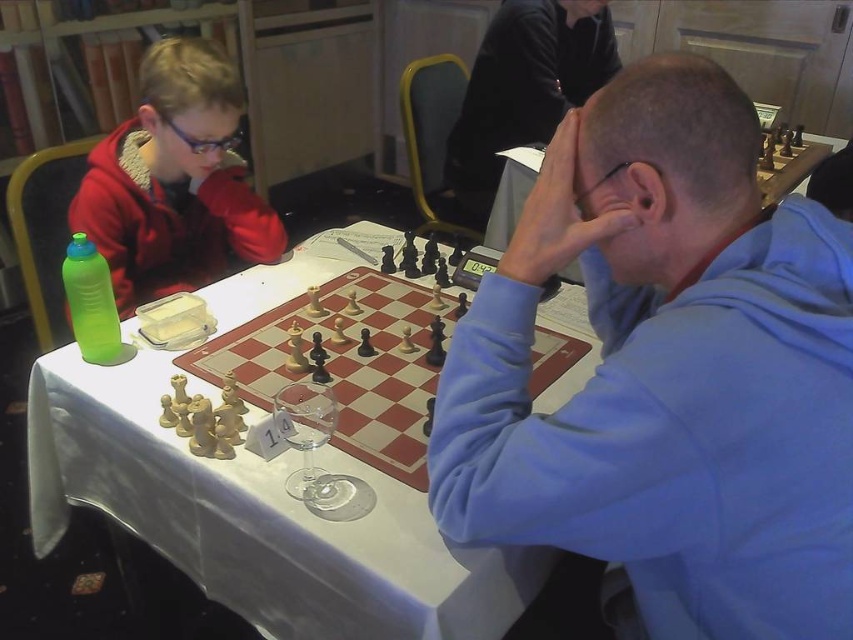
Question: Does matte red jacket at upper left appear on the right side of wooden chessboard at center?

Choices:
 (A) yes
 (B) no

Answer: (B)

Question: Can you confirm if wooden chess set at center is wider than smooth black jacket at upper center?

Choices:
 (A) no
 (B) yes

Answer: (B)

Question: Is blue fleece jacket at center further to the viewer compared to matte red jacket at upper left?

Choices:
 (A) no
 (B) yes

Answer: (A)

Question: Which point is farther from the camera taking this photo?

Choices:
 (A) (583, 346)
 (B) (155, 228)
 (C) (328, 460)
 (D) (790, 579)

Answer: (B)

Question: Which of these objects is positioned closest to the wooden chessboard at center?

Choices:
 (A) matte red jacket at upper left
 (B) wooden chess set at center

Answer: (B)

Question: Among these objects, which one is nearest to the camera?

Choices:
 (A) matte red jacket at upper left
 (B) wooden chess set at center
 (C) blue fleece jacket at center
 (D) smooth black jacket at upper center

Answer: (C)